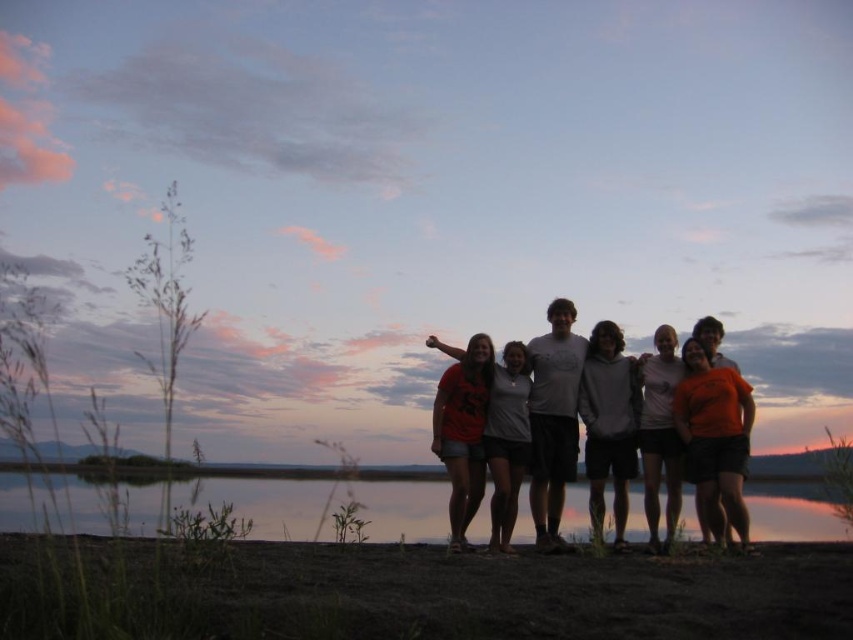
Question: Estimate the real-world distances between objects in this image. Which object is closer to the transparent water at lower center?

Choices:
 (A) orange matte shirt at center
 (B) orange cotton shirt at center
 (C) matte orange shirt at center

Answer: (A)

Question: Which point is closer to the camera taking this photo?

Choices:
 (A) (677, 394)
 (B) (666, 536)

Answer: (B)

Question: Among these objects, which one is nearest to the camera?

Choices:
 (A) matte red t-shirt at center
 (B) gray hoodie at center
 (C) matte orange shirt at center

Answer: (A)

Question: Can you confirm if orange matte shirt at center is positioned to the right of orange cotton shirt at center?

Choices:
 (A) no
 (B) yes

Answer: (B)

Question: Does matte red t-shirt at center appear under orange cotton shirt at center?

Choices:
 (A) yes
 (B) no

Answer: (A)

Question: Does gray hoodie at center appear on the right side of orange cotton shirt at center?

Choices:
 (A) yes
 (B) no

Answer: (B)